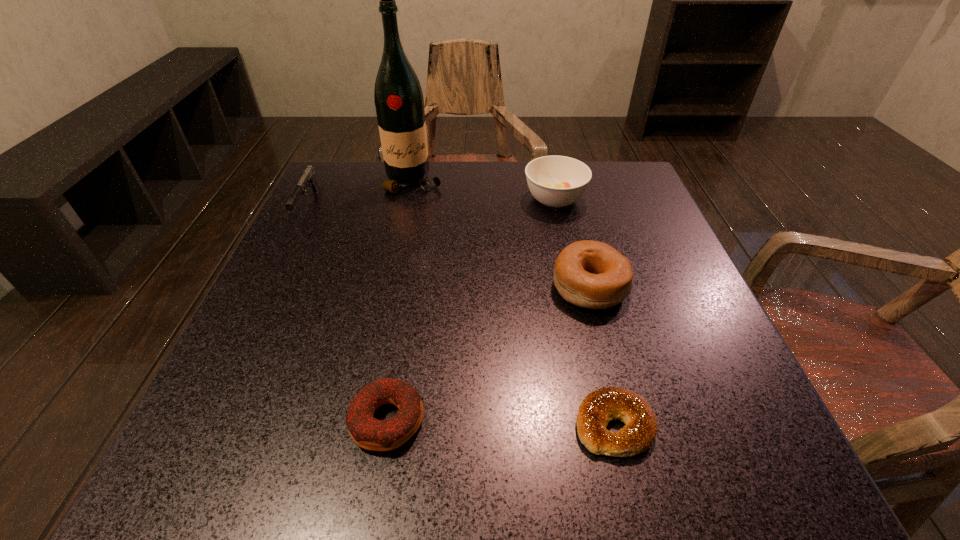
Image resolution: width=960 pixels, height=540 pixels. I want to click on soup bowl that is at the right edge, so click(556, 181).

What are the coordinates of `object positioned at the far left corner` in the screenshot? It's located at (308, 177).

The width and height of the screenshot is (960, 540). I want to click on object that is positioned at the far right corner, so click(x=556, y=181).

Identify the location of object that is at the near right corner. The image size is (960, 540). (598, 408).

At what (x,y) coordinates should I click in order to perform the action: click on free space at the far edge of the desktop. Please return your answer as a coordinate pair (x, y). Looking at the image, I should click on (495, 174).

The height and width of the screenshot is (540, 960). In the image, there is a desktop. In order to click on vacant space at the near edge in this screenshot , I will do `click(446, 457)`.

In the image, there is a desktop. At what (x,y) coordinates should I click in order to perform the action: click on vacant space at the left edge. Please return your answer as a coordinate pair (x, y). The image size is (960, 540). Looking at the image, I should click on (348, 220).

Locate an element on the screen. Image resolution: width=960 pixels, height=540 pixels. vacant position at the right edge of the desktop is located at coordinates (648, 249).

Image resolution: width=960 pixels, height=540 pixels. In order to click on vacant space at the far left corner of the desktop in this screenshot , I will do `click(300, 214)`.

Identify the location of free space at the far right corner of the desktop. (592, 200).